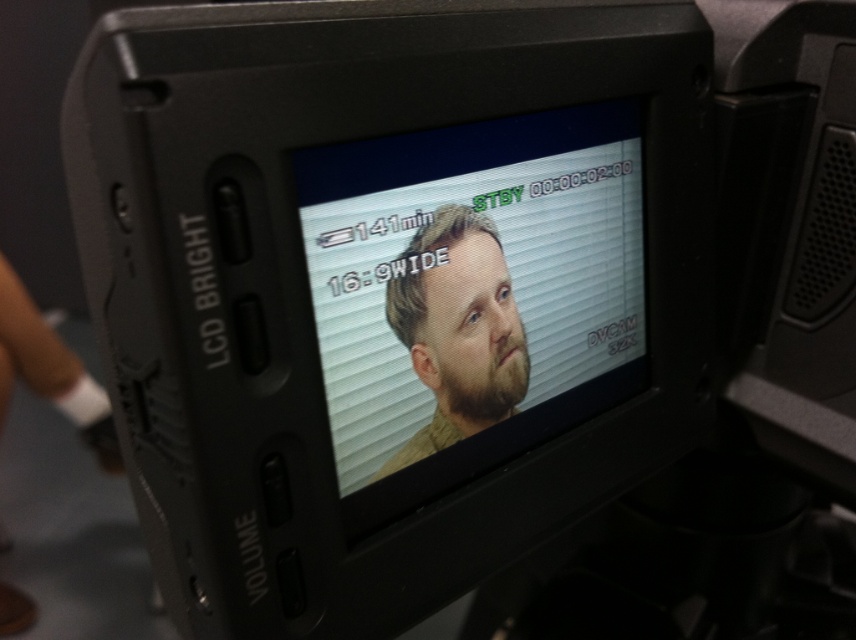
Which is in front, point (349, 396) or point (488, 396)?

Positioned in front is point (349, 396).

Who is positioned more to the left, matte black monitor at center or beige fabric face at center?

beige fabric face at center is more to the left.

Describe the element at coordinates (470, 275) in the screenshot. I see `matte black monitor at center` at that location.

Where is `matte black monitor at center`? The height and width of the screenshot is (640, 856). matte black monitor at center is located at coordinates (470, 275).